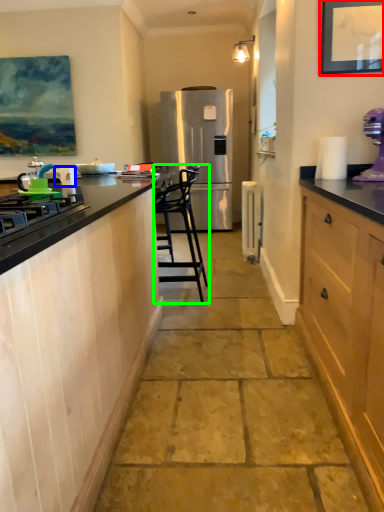
Question: Considering the real-world distances, which object is farthest from picture frame (highlighted by a red box)? appliance (highlighted by a blue box) or chair (highlighted by a green box)?

Choices:
 (A) appliance
 (B) chair

Answer: (B)